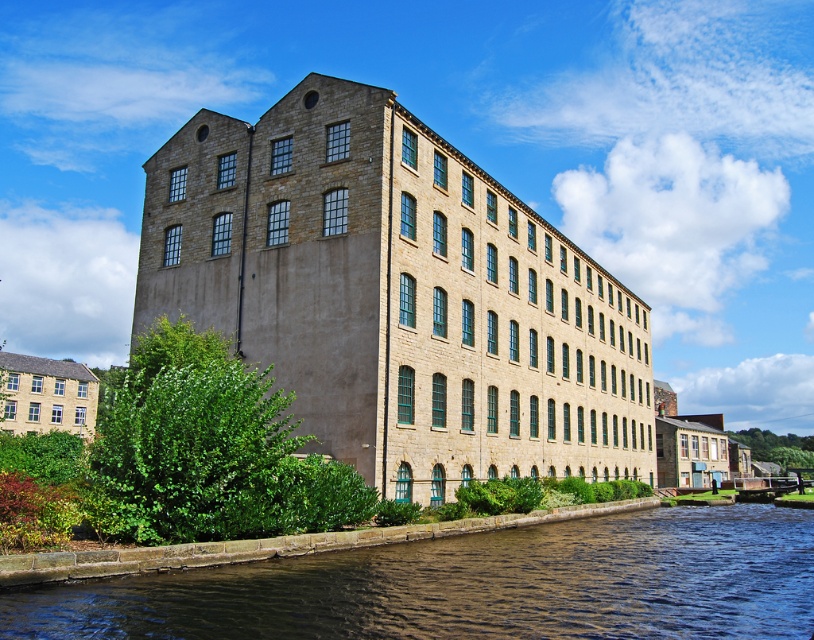
Question: Can you confirm if beige stone building at center is thinner than brown water at lower center?

Choices:
 (A) yes
 (B) no

Answer: (B)

Question: Which of the following is the closest to the observer?

Choices:
 (A) brown water at lower center
 (B) beige stone building at center

Answer: (A)

Question: Can you confirm if beige stone building at center is smaller than brown water at lower center?

Choices:
 (A) no
 (B) yes

Answer: (A)

Question: Which point is farther to the camera?

Choices:
 (A) beige stone building at center
 (B) brown water at lower center

Answer: (A)

Question: Is beige stone building at center below brown water at lower center?

Choices:
 (A) no
 (B) yes

Answer: (A)